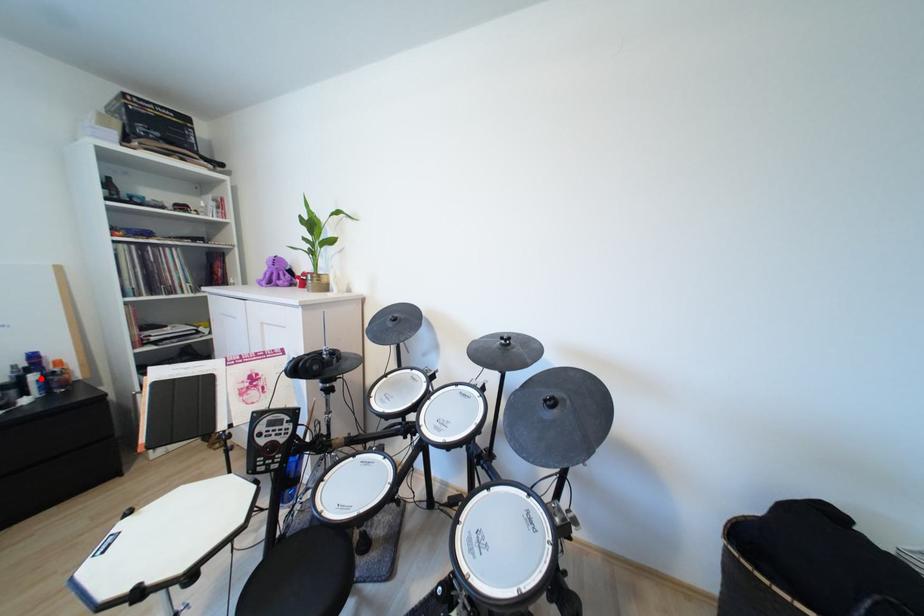
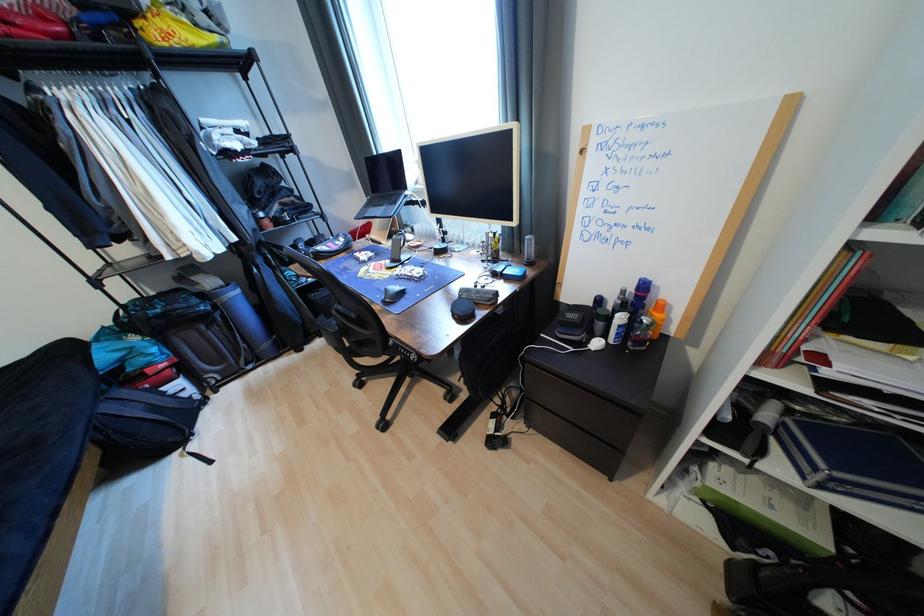
Question: I am providing you with two images of the same scene from different viewpoints. A red point is marked on the first image. At the location where the point appears in image 1, is it still visible in image 2?

Choices:
 (A) Yes
 (B) No

Answer: (A)